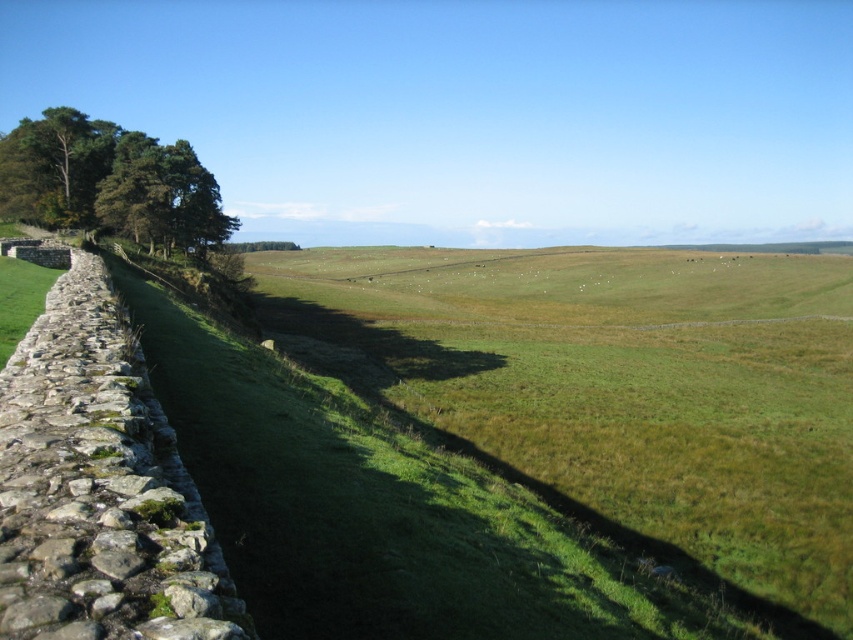
Which is in front, point (451, 435) or point (57, 186)?

Point (451, 435) is in front.

Is point (361, 269) farther from viewer compared to point (142, 145)?

Yes, it is.

The image size is (853, 640). Identify the location of green grassy field at center. (521, 444).

Where is `green grassy field at center`? The image size is (853, 640). green grassy field at center is located at coordinates tap(521, 444).